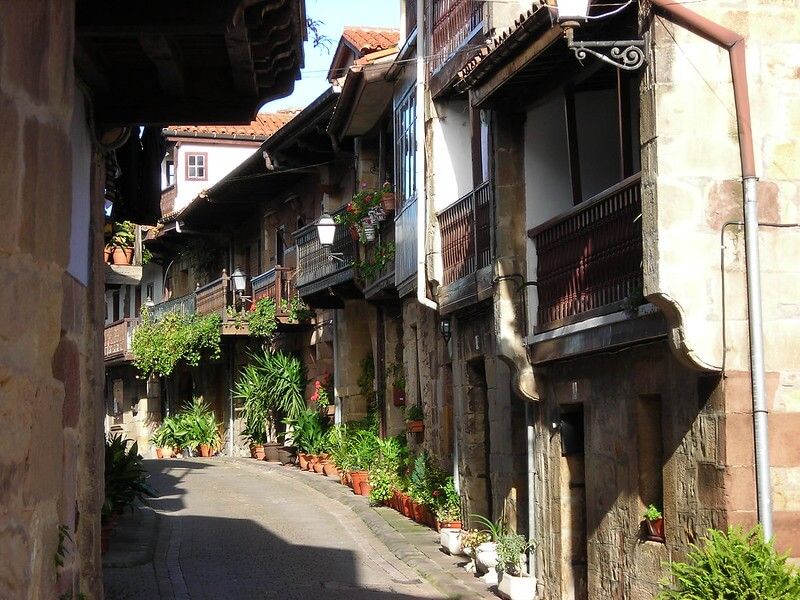
Find the location of `hanging plants`. hanging plants is located at coordinates (261, 314), (193, 319), (162, 336), (138, 333).